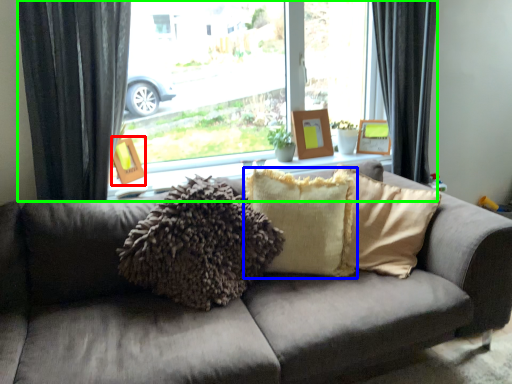
Question: Which object is the farthest from picture frame (highlighted by a red box)? Choose among these: pillow (highlighted by a blue box) or window (highlighted by a green box).

Choices:
 (A) pillow
 (B) window

Answer: (A)